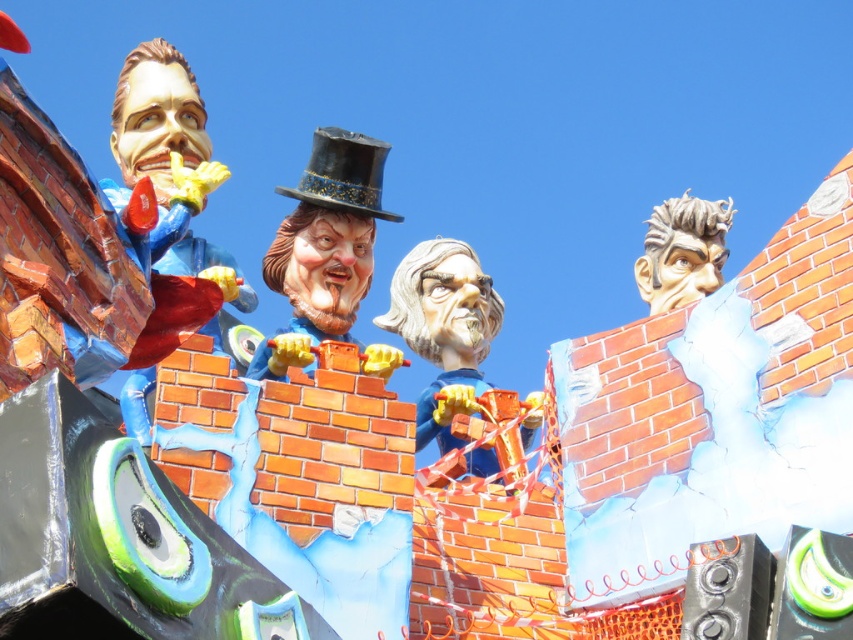
You are an artist trying to sketch the two central figures in the scene. The matte blue figure at center and the shiny black dress hat at center. Which one has a smaller width?

The matte blue figure at center is thinner than the shiny black dress hat at center, so the matte blue figure at center has a smaller width.

What are the coordinates of the matte blue figure at center?

The matte blue figure at center is located at coordinates point (444, 330).